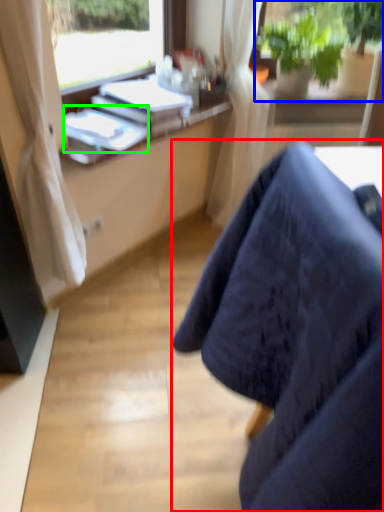
Question: Based on their relative distances, which object is farther from chair (highlighted by a red box)? Choose from houseplant (highlighted by a blue box) and book (highlighted by a green box).

Choices:
 (A) houseplant
 (B) book

Answer: (A)